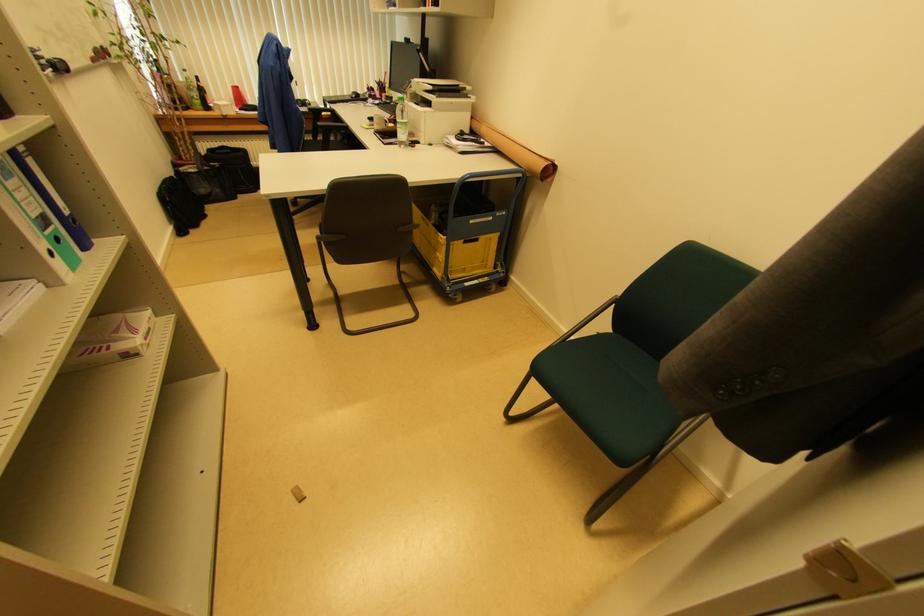
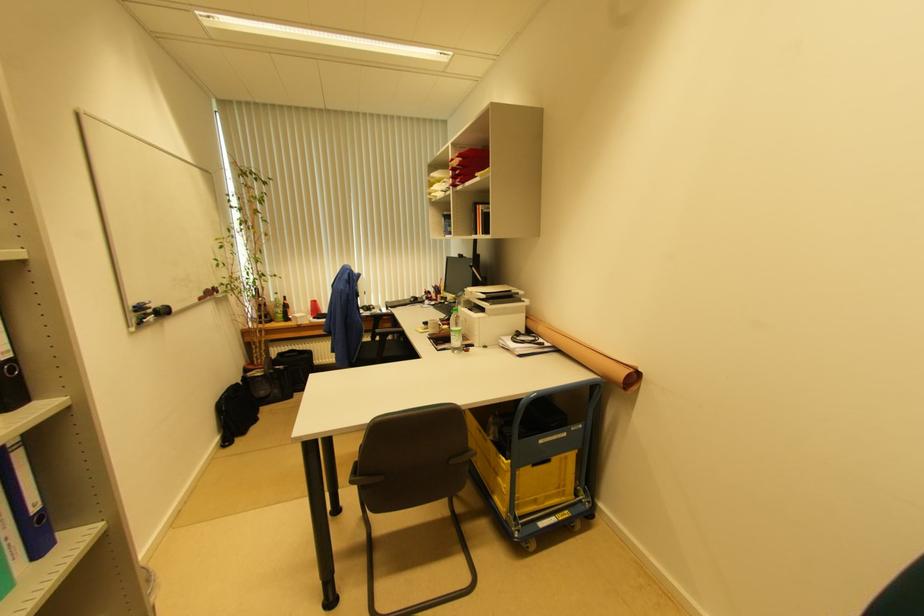
Question: What movement of the cameraman would produce the second image?

Choices:
 (A) Left
 (B) Right
 (C) Forward
 (D) Backward

Answer: (C)